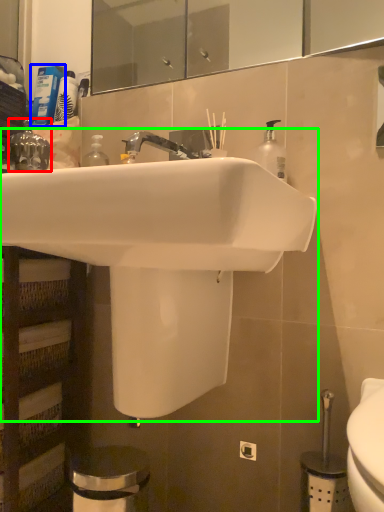
Question: Based on their relative distances, which object is farther from plumbing fixture (highlighted by a red box)? Choose from toiletry (highlighted by a blue box) and sink (highlighted by a green box).

Choices:
 (A) toiletry
 (B) sink

Answer: (B)